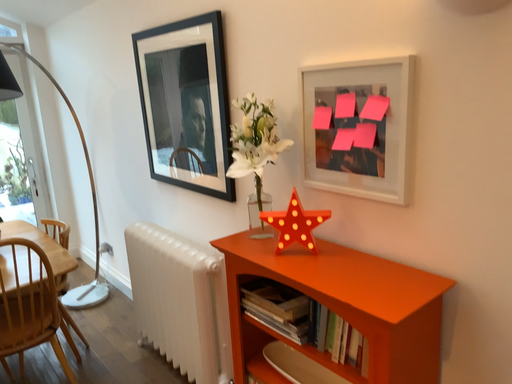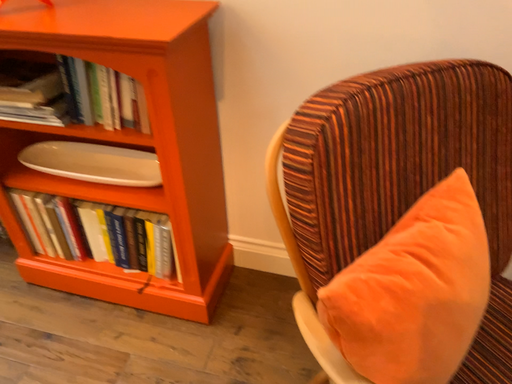
Question: How did the camera likely rotate when shooting the video?

Choices:
 (A) rotated upward
 (B) rotated downward

Answer: (B)